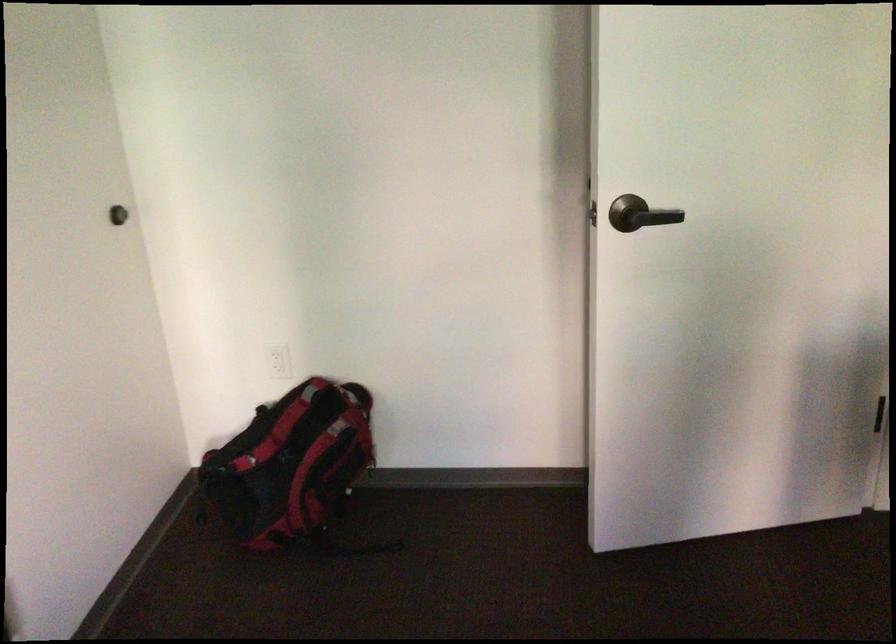
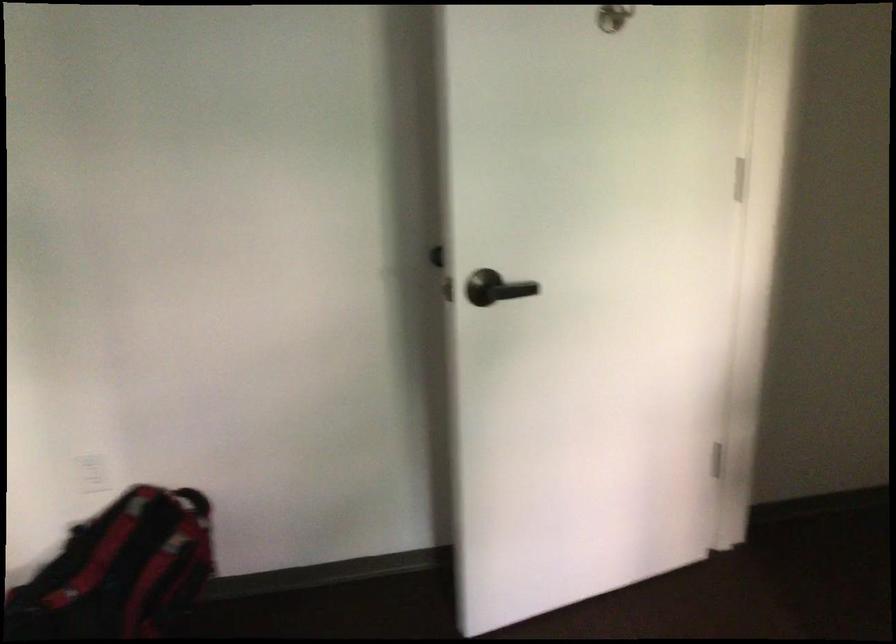
What movement of the cameraman would produce the second image?

The cameraman walked toward left, forward.